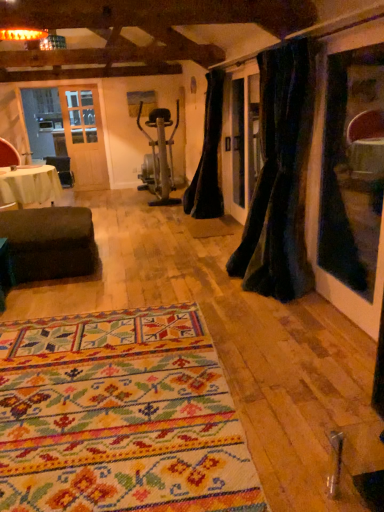
Question: Considering the relative sizes of red leather armchair at left and black velvet curtain at center, the first curtain positioned from the left, in the image provided, is red leather armchair at left thinner than black velvet curtain at center, the first curtain positioned from the left,?

Choices:
 (A) no
 (B) yes

Answer: (A)

Question: Can you confirm if red leather armchair at left is wider than black velvet curtain at center, arranged as the 1th curtain when viewed from the back?

Choices:
 (A) no
 (B) yes

Answer: (B)

Question: Is the position of red leather armchair at left more distant than that of black velvet curtain at center, acting as the 2th curtain starting from the right?

Choices:
 (A) no
 (B) yes

Answer: (B)

Question: From a real-world perspective, is red leather armchair at left physically below black velvet curtain at center, marked as the 2th curtain in a front-to-back arrangement?

Choices:
 (A) yes
 (B) no

Answer: (A)

Question: Considering the relative positions of red leather armchair at left and black velvet curtain at center, the first curtain positioned from the left, in the image provided, is red leather armchair at left to the left of black velvet curtain at center, the first curtain positioned from the left, from the viewer's perspective?

Choices:
 (A) no
 (B) yes

Answer: (B)

Question: From the image's perspective, is red leather armchair at left above black velvet curtain at center, the first curtain positioned from the left?

Choices:
 (A) no
 (B) yes

Answer: (B)

Question: Is multicolored woven rug at center to the right of red leather armchair at left from the viewer's perspective?

Choices:
 (A) yes
 (B) no

Answer: (A)

Question: Does multicolored woven rug at center have a larger size compared to red leather armchair at left?

Choices:
 (A) yes
 (B) no

Answer: (A)

Question: Is red leather armchair at left at the back of multicolored woven rug at center?

Choices:
 (A) yes
 (B) no

Answer: (B)

Question: Is multicolored woven rug at center at the left side of red leather armchair at left?

Choices:
 (A) no
 (B) yes

Answer: (A)

Question: Considering the relative sizes of multicolored woven rug at center and red leather armchair at left in the image provided, is multicolored woven rug at center smaller than red leather armchair at left?

Choices:
 (A) no
 (B) yes

Answer: (A)

Question: Can you confirm if multicolored woven rug at center is taller than red leather armchair at left?

Choices:
 (A) no
 (B) yes

Answer: (A)

Question: Is multicolored woven rug at center bigger than white fabric-covered table at left?

Choices:
 (A) yes
 (B) no

Answer: (B)